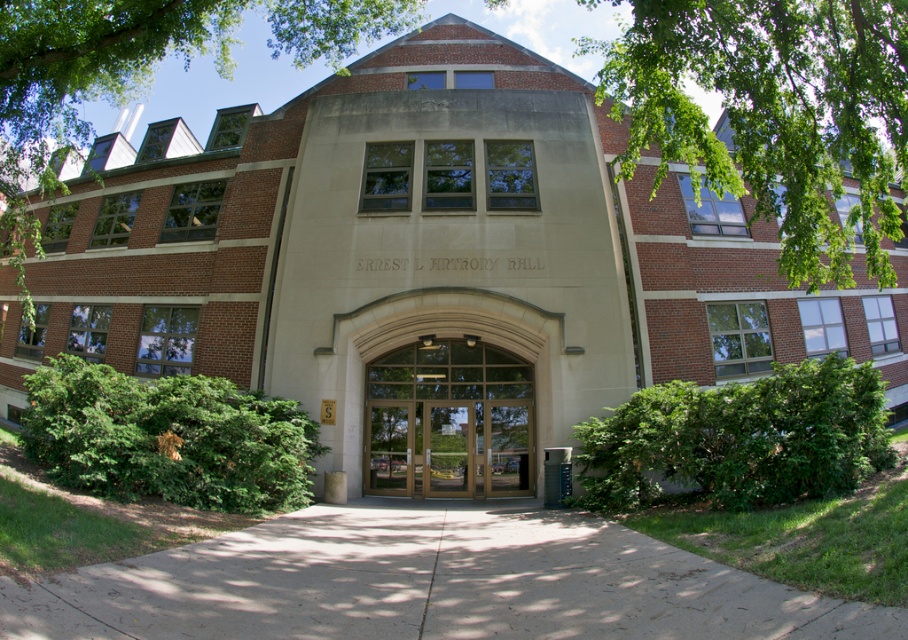
Who is positioned more to the right, green leafy tree at upper right or wooden doors at center?

green leafy tree at upper right

You are a GUI agent. You are given a task and a screenshot of the screen. Output one action in this format:
    pyautogui.click(x=<x>, y=<y>)
    Task: Click on the green leafy tree at upper right
    Image resolution: width=908 pixels, height=640 pixels.
    Given the screenshot: What is the action you would take?
    pyautogui.click(x=775, y=113)

The width and height of the screenshot is (908, 640). I want to click on green leafy tree at upper right, so click(775, 113).

Is point (811, 60) less distant than point (27, 20)?

Yes.

Does green leafy tree at upper right lie in front of green leafy tree at upper left?

Yes, green leafy tree at upper right is in front of green leafy tree at upper left.

Is point (729, 115) positioned after point (52, 193)?

No, (729, 115) is closer to viewer.

Image resolution: width=908 pixels, height=640 pixels. What are the coordinates of `green leafy tree at upper right` in the screenshot? It's located at (775, 113).

Is green leafy tree at upper left to the left of wooden doors at center from the viewer's perspective?

Indeed, green leafy tree at upper left is positioned on the left side of wooden doors at center.

Can you confirm if green leafy tree at upper left is shorter than wooden doors at center?

No, green leafy tree at upper left is not shorter than wooden doors at center.

At what (x,y) coordinates should I click in order to perform the action: click on green leafy tree at upper left. Please return your answer as a coordinate pair (x, y). This screenshot has height=640, width=908. Looking at the image, I should click on (133, 72).